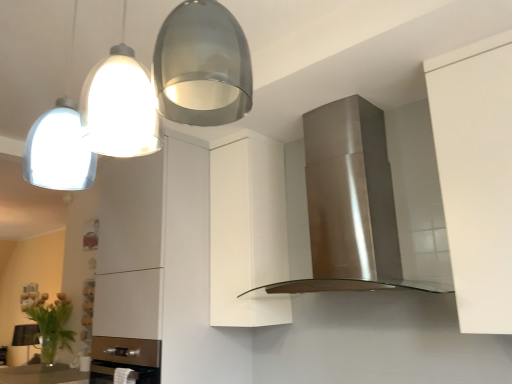
Question: From a real-world perspective, is green leafy plant at lower left physically above stainless steel range hood at center?

Choices:
 (A) yes
 (B) no

Answer: (B)

Question: From a real-world perspective, is green leafy plant at lower left physically below stainless steel range hood at center?

Choices:
 (A) no
 (B) yes

Answer: (B)

Question: Is green leafy plant at lower left thinner than stainless steel range hood at center?

Choices:
 (A) yes
 (B) no

Answer: (A)

Question: Does green leafy plant at lower left have a greater height compared to stainless steel range hood at center?

Choices:
 (A) yes
 (B) no

Answer: (B)

Question: From the image's perspective, is green leafy plant at lower left under stainless steel range hood at center?

Choices:
 (A) yes
 (B) no

Answer: (A)

Question: Can you confirm if green leafy plant at lower left is positioned to the left of stainless steel range hood at center?

Choices:
 (A) yes
 (B) no

Answer: (A)

Question: Does green leafy plant at lower left turn towards satin silver pendant lights at upper left?

Choices:
 (A) yes
 (B) no

Answer: (B)

Question: Is satin silver pendant lights at upper left inside green leafy plant at lower left?

Choices:
 (A) no
 (B) yes

Answer: (A)

Question: From the image's perspective, is green leafy plant at lower left on satin silver pendant lights at upper left?

Choices:
 (A) no
 (B) yes

Answer: (A)

Question: Does green leafy plant at lower left have a greater width compared to satin silver pendant lights at upper left?

Choices:
 (A) no
 (B) yes

Answer: (A)

Question: From a real-world perspective, is green leafy plant at lower left physically below satin silver pendant lights at upper left?

Choices:
 (A) no
 (B) yes

Answer: (B)

Question: Is green leafy plant at lower left not close to satin silver pendant lights at upper left?

Choices:
 (A) yes
 (B) no

Answer: (A)

Question: Considering the relative sizes of green leafy plant at lower left and white matte cabinet at center in the image provided, is green leafy plant at lower left taller than white matte cabinet at center?

Choices:
 (A) no
 (B) yes

Answer: (A)